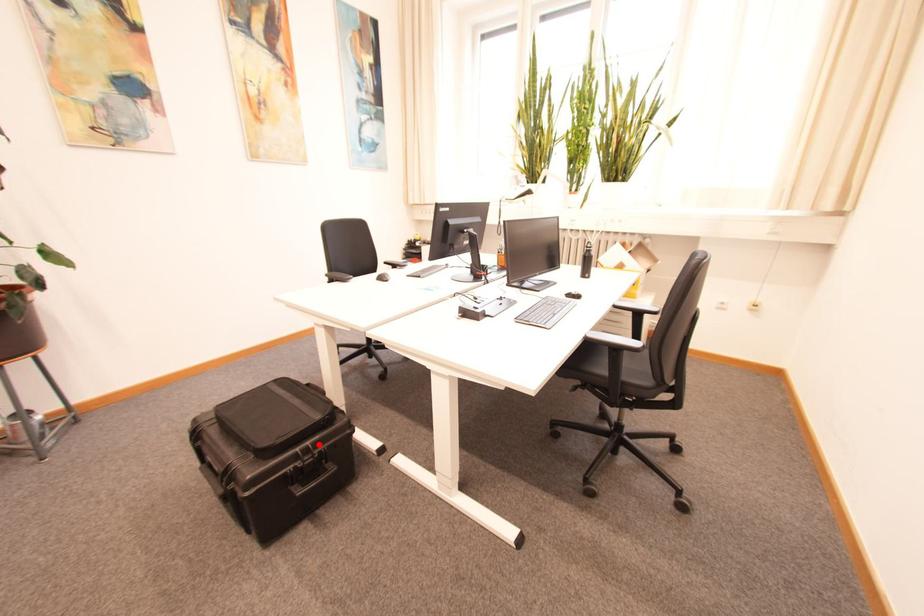
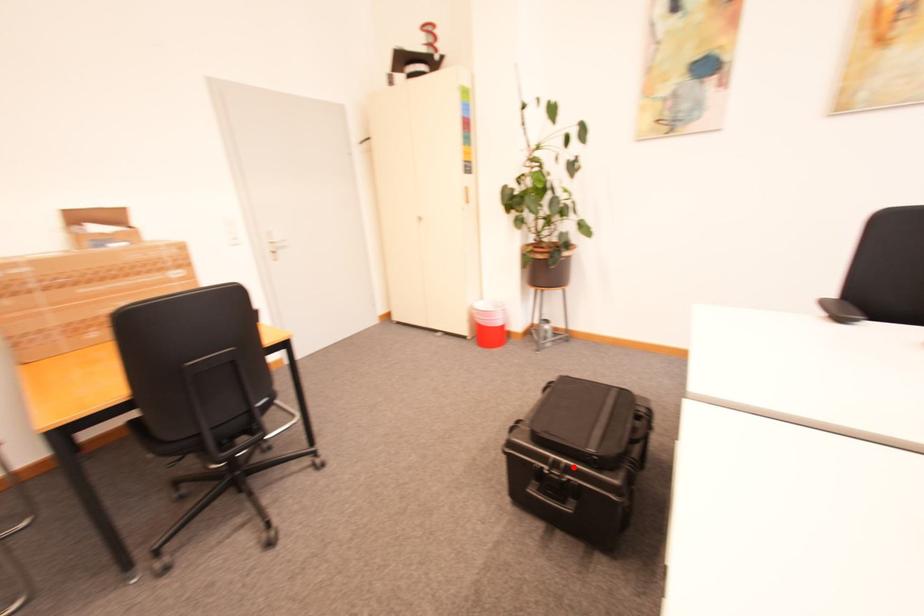
I am providing you with two images of the same scene from different viewpoints. A red point is marked on the first image and another point is marked on the second image. Does the point marked in image1 correspond to the same location as the one in image2?

Yes